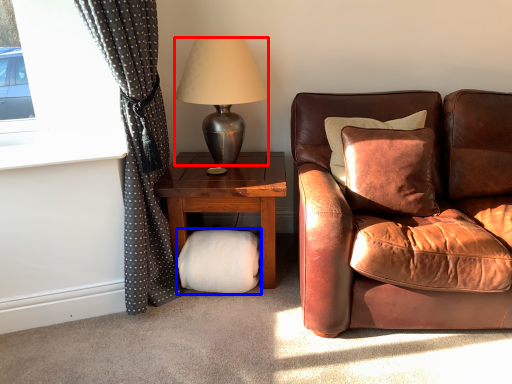
Question: Among these objects, which one is nearest to the camera, lamp (highlighted by a red box) or footrest (highlighted by a blue box)?

Choices:
 (A) lamp
 (B) footrest

Answer: (A)